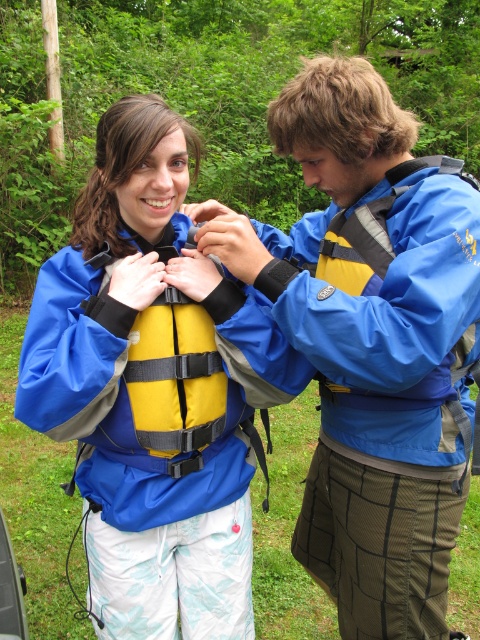
You are a tailor measuring two jackets for alterations. You have a blue waterproof jacket at center and a matte blue jacket at center. Which jacket is closer to the center of the image?

Both jackets are at the center of the image. The blue waterproof jacket at center is 12.05 inches away from matte blue jacket at center, so they are both positioned centrally but separated by that distance.

You are a lifeguard observing two people in the image. The blue waterproof jacket at center and the matte blue jacket at center are overlapping. Which jacket is visible on top?

The blue waterproof jacket at center is visible on top because it is in front of the matte blue jacket at center.